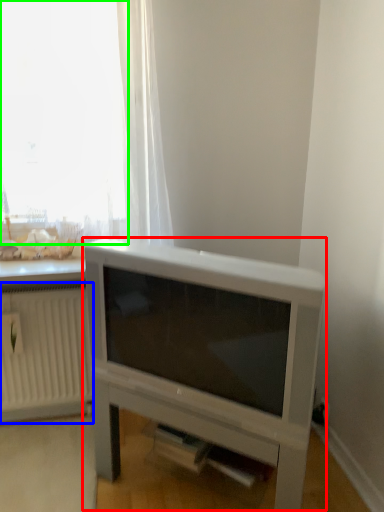
Question: Based on their relative distances, which object is farther from entertainment center (highlighted by a red box)? Choose from radiator (highlighted by a blue box) and window (highlighted by a green box).

Choices:
 (A) radiator
 (B) window

Answer: (B)